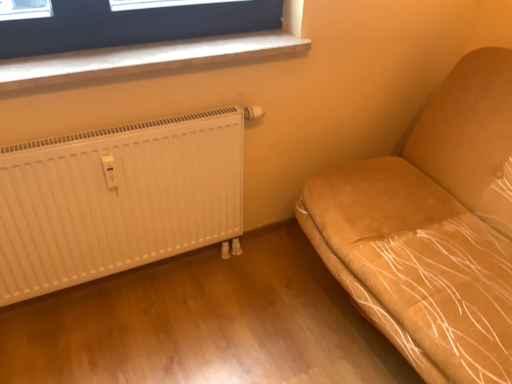
Measure the distance between suede-like tan sofa at right and camera.

3.36 feet.

What do you see at coordinates (152, 56) in the screenshot?
I see `white plastic window sill at upper left` at bounding box center [152, 56].

Identify the location of white ribbed radiator at lower left. (118, 200).

Does point (511, 196) lie in front of point (141, 125)?

No, (511, 196) is further to viewer.

Can you see suede-like tan sofa at right touching white ribbed radiator at lower left?

No.

Is suede-like tan sofa at right positioned behind white ribbed radiator at lower left?

No.

Could you tell me if suede-like tan sofa at right is facing white ribbed radiator at lower left?

Yes, suede-like tan sofa at right is facing white ribbed radiator at lower left.

From a real-world perspective, who is located lower, white plastic window sill at upper left or suede-like tan sofa at right?

suede-like tan sofa at right is physically lower.

Which point is more forward, [296,4] or [501,87]?

The point [296,4] is in front.

Can you confirm if white plastic window sill at upper left is shorter than suede-like tan sofa at right?

Yes, white plastic window sill at upper left is shorter than suede-like tan sofa at right.

Is suede-like tan sofa at right located within white plastic window sill at upper left?

That's incorrect, suede-like tan sofa at right is not inside white plastic window sill at upper left.

Considering the relative sizes of suede-like tan sofa at right and white plastic window sill at upper left in the image provided, is suede-like tan sofa at right bigger than white plastic window sill at upper left?

Yes, suede-like tan sofa at right is bigger than white plastic window sill at upper left.

Is suede-like tan sofa at right not near white plastic window sill at upper left?

No, suede-like tan sofa at right is not far from white plastic window sill at upper left.

Considering the sizes of objects suede-like tan sofa at right and white plastic window sill at upper left in the image provided, who is shorter, suede-like tan sofa at right or white plastic window sill at upper left?

With less height is white plastic window sill at upper left.

Can we say suede-like tan sofa at right lies outside white plastic window sill at upper left?

Indeed, suede-like tan sofa at right is completely outside white plastic window sill at upper left.

From the picture: Does white plastic window sill at upper left have a greater width compared to white ribbed radiator at lower left?

Yes, white plastic window sill at upper left is wider than white ribbed radiator at lower left.

Based on their sizes in the image, would you say white plastic window sill at upper left is bigger or smaller than white ribbed radiator at lower left?

Clearly, white plastic window sill at upper left is smaller in size than white ribbed radiator at lower left.

Is white plastic window sill at upper left aimed at white ribbed radiator at lower left?

No.

Image resolution: width=512 pixels, height=384 pixels. I want to click on radiator located below the white plastic window sill at upper left (from the image's perspective), so click(118, 200).

Which object is positioned more to the right, white ribbed radiator at lower left or white plastic window sill at upper left?

white plastic window sill at upper left.

Can you tell me how much white ribbed radiator at lower left and white plastic window sill at upper left differ in facing direction?

0.674 degrees separate the facing orientations of white ribbed radiator at lower left and white plastic window sill at upper left.

In terms of height, does white ribbed radiator at lower left look taller or shorter compared to white plastic window sill at upper left?

In the image, white ribbed radiator at lower left appears to be taller than white plastic window sill at upper left.

Considering the positions of objects white ribbed radiator at lower left and white plastic window sill at upper left in the image provided, who is behind, white ribbed radiator at lower left or white plastic window sill at upper left?

white plastic window sill at upper left is behind.

Would you say white ribbed radiator at lower left is outside suede-like tan sofa at right?

Yes, white ribbed radiator at lower left is outside of suede-like tan sofa at right.

Is white ribbed radiator at lower left taller or shorter than suede-like tan sofa at right?

Considering their sizes, white ribbed radiator at lower left has less height than suede-like tan sofa at right.

Can you confirm if white ribbed radiator at lower left is thinner than suede-like tan sofa at right?

Correct, the width of white ribbed radiator at lower left is less than that of suede-like tan sofa at right.

Does white ribbed radiator at lower left come in front of suede-like tan sofa at right?

No.

Identify the location of furniture that is in front of the white ribbed radiator at lower left. Image resolution: width=512 pixels, height=384 pixels. (432, 229).

Identify the location of furniture that appears below the white plastic window sill at upper left (from the image's perspective). Image resolution: width=512 pixels, height=384 pixels. (432, 229).

Considering their positions, is white ribbed radiator at lower left positioned further to suede-like tan sofa at right than white plastic window sill at upper left?

white plastic window sill at upper left is positioned further to the anchor suede-like tan sofa at right.

Based on their spatial positions, is suede-like tan sofa at right or white plastic window sill at upper left closer to white ribbed radiator at lower left?

Among the two, white plastic window sill at upper left is located nearer to white ribbed radiator at lower left.

Considering their positions, is white plastic window sill at upper left positioned closer to suede-like tan sofa at right than white ribbed radiator at lower left?

white ribbed radiator at lower left is positioned closer to the anchor suede-like tan sofa at right.

Estimate the real-world distances between objects in this image. Which object is closer to white plastic window sill at upper left, suede-like tan sofa at right or white ribbed radiator at lower left?

The object closer to white plastic window sill at upper left is white ribbed radiator at lower left.

Estimate the real-world distances between objects in this image. Which object is closer to white ribbed radiator at lower left, white plastic window sill at upper left or suede-like tan sofa at right?

white plastic window sill at upper left.

When comparing their distances from white plastic window sill at upper left, does white ribbed radiator at lower left or suede-like tan sofa at right seem closer?

white ribbed radiator at lower left.

Locate an element on the screen. This screenshot has width=512, height=384. window between white ribbed radiator at lower left and suede-like tan sofa at right from left to right is located at coordinates (152, 56).